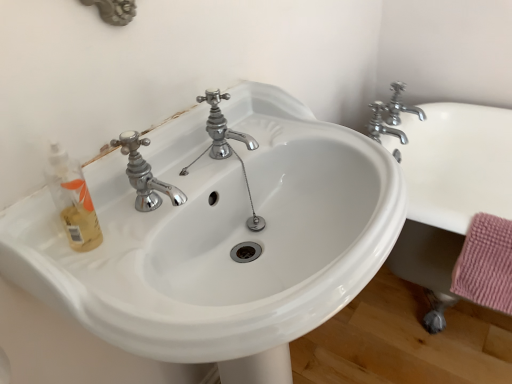
This screenshot has width=512, height=384. Identify the location of white glossy sink at center. (219, 236).

From their relative heights in the image, would you say white ceramic bath at right is taller or shorter than white glossy sink at center?

white ceramic bath at right is shorter than white glossy sink at center.

Does white ceramic bath at right contain white glossy sink at center?

That's incorrect, white glossy sink at center is not inside white ceramic bath at right.

Considering the positions of point (458, 128) and point (293, 203), is point (458, 128) closer or farther from the camera than point (293, 203)?

Point (458, 128) appears to be farther away from the viewer than point (293, 203).

Between white glossy sink at center and chrome metallic faucet at upper right, acting as the first tap starting from the right, which one is positioned behind?

chrome metallic faucet at upper right, acting as the first tap starting from the right, is more distant.

Does point (204, 186) appear closer or farther from the camera than point (388, 107)?

Point (204, 186) is positioned closer to the camera compared to point (388, 107).

Is white glossy sink at center outside of chrome metallic faucet at upper right, acting as the first tap starting from the right?

Yes, white glossy sink at center is located beyond the bounds of chrome metallic faucet at upper right, acting as the first tap starting from the right.

Is white ceramic bath at right next to chrome metallic faucet at upper right, the 1th tap viewed from the left?

No, white ceramic bath at right is not with chrome metallic faucet at upper right, the 1th tap viewed from the left.

Find the location of `bath that is under the chrome metallic faucet at upper right, the 1th tap viewed from the left (from a real-world perspective)`. bath that is under the chrome metallic faucet at upper right, the 1th tap viewed from the left (from a real-world perspective) is located at coordinates tap(449, 191).

In the scene shown: Does white ceramic bath at right have a greater height compared to chrome metallic faucet at upper right, the second tap from the right?

Correct, white ceramic bath at right is much taller as chrome metallic faucet at upper right, the second tap from the right.

In terms of width, does white ceramic bath at right look wider or thinner when compared to chrome metallic faucet at upper right, the second tap from the right?

white ceramic bath at right is wider than chrome metallic faucet at upper right, the second tap from the right.

Which of these two, chrome metallic faucet at upper right, acting as the first tap starting from the right, or white ceramic bath at right, is wider?

white ceramic bath at right.

Is chrome metallic faucet at upper right, acting as the 2th tap starting from the left, turned away from white ceramic bath at right?

No, chrome metallic faucet at upper right, acting as the 2th tap starting from the left, is not facing away from white ceramic bath at right.

Would you say chrome metallic faucet at upper right, acting as the first tap starting from the right, is inside or outside white ceramic bath at right?

chrome metallic faucet at upper right, acting as the first tap starting from the right, is located beyond the bounds of white ceramic bath at right.

What are the coordinates of `bath below the chrome metallic faucet at upper right, acting as the first tap starting from the right (from a real-world perspective)` in the screenshot? It's located at (449, 191).

From the image's perspective, between chrome metallic faucet at upper right, the second tap from the right, and white ceramic bath at right, who is located below?

white ceramic bath at right appears lower in the image.

Can you see chrome metallic faucet at upper right, the second tap from the right, touching white ceramic bath at right?

No, chrome metallic faucet at upper right, the second tap from the right, is not next to white ceramic bath at right.

Is chrome metallic faucet at upper right, the second tap from the right, in front of white ceramic bath at right?

No, chrome metallic faucet at upper right, the second tap from the right, is further to the viewer.

Which is more to the right, chrome metallic faucet at upper right, the second tap from the right, or white ceramic bath at right?

white ceramic bath at right.

Is the surface of white ceramic bath at right in direct contact with chrome metallic faucet at upper right, acting as the first tap starting from the right?

No, white ceramic bath at right is not making contact with chrome metallic faucet at upper right, acting as the first tap starting from the right.

Measure the distance between white ceramic bath at right and chrome metallic faucet at upper right, acting as the first tap starting from the right.

7.60 inches.

From the image's perspective, is white ceramic bath at right located above or below chrome metallic faucet at upper right, acting as the 2th tap starting from the left?

From the image's perspective, white ceramic bath at right appears below chrome metallic faucet at upper right, acting as the 2th tap starting from the left.

Find the location of `bath that appears below the chrome metallic faucet at upper right, acting as the 2th tap starting from the left (from a real-world perspective)`. bath that appears below the chrome metallic faucet at upper right, acting as the 2th tap starting from the left (from a real-world perspective) is located at coordinates (449, 191).

How many degrees apart are the facing directions of chrome metallic faucet at upper right, acting as the 2th tap starting from the left, and white glossy sink at center?

They differ by 0.557 degrees in their facing directions.

From a real-world perspective, which is physically above, chrome metallic faucet at upper right, acting as the 2th tap starting from the left, or white glossy sink at center?

chrome metallic faucet at upper right, acting as the 2th tap starting from the left, from a real-world perspective.

From the picture: Is chrome metallic faucet at upper right, acting as the 2th tap starting from the left, positioned with its back to white glossy sink at center?

No, chrome metallic faucet at upper right, acting as the 2th tap starting from the left, is not facing away from white glossy sink at center.

Considering the sizes of objects chrome metallic faucet at upper right, acting as the 2th tap starting from the left, and white glossy sink at center in the image provided, who is shorter, chrome metallic faucet at upper right, acting as the 2th tap starting from the left, or white glossy sink at center?

Standing shorter between the two is chrome metallic faucet at upper right, acting as the 2th tap starting from the left.

Find the location of a particular element. Image resolution: width=512 pixels, height=384 pixels. sink that is in front of the white ceramic bath at right is located at coordinates (219, 236).

Where is `tap that is the 2nd object located above the white glossy sink at center (from the image's perspective)`? The width and height of the screenshot is (512, 384). tap that is the 2nd object located above the white glossy sink at center (from the image's perspective) is located at coordinates (400, 106).

Based on their spatial positions, is chrome metallic faucet at upper right, the second tap from the right, or white ceramic bath at right further from white glossy sink at center?

Among the two, white ceramic bath at right is located further to white glossy sink at center.

Based on the photo, considering their positions, is white glossy sink at center positioned further to white ceramic bath at right than chrome metallic faucet at upper right, acting as the first tap starting from the right?

white glossy sink at center.

When comparing their distances from chrome metallic faucet at upper right, acting as the first tap starting from the right, does white glossy sink at center or chrome metallic faucet at upper right, the second tap from the right, seem closer?

Based on the image, chrome metallic faucet at upper right, the second tap from the right, appears to be nearer to chrome metallic faucet at upper right, acting as the first tap starting from the right.

Considering their positions, is chrome metallic faucet at upper right, the 1th tap viewed from the left, positioned closer to chrome metallic faucet at upper right, acting as the first tap starting from the right, than white glossy sink at center?

chrome metallic faucet at upper right, the 1th tap viewed from the left.

Which object lies nearer to the anchor point chrome metallic faucet at upper right, acting as the 2th tap starting from the left, white ceramic bath at right or white glossy sink at center?

Among the two, white ceramic bath at right is located nearer to chrome metallic faucet at upper right, acting as the 2th tap starting from the left.

Looking at the image, which one is located further to chrome metallic faucet at upper right, the second tap from the right, chrome metallic faucet at upper right, acting as the first tap starting from the right, or white ceramic bath at right?

white ceramic bath at right is further to chrome metallic faucet at upper right, the second tap from the right.

Estimate the real-world distances between objects in this image. Which object is closer to white glossy sink at center, chrome metallic faucet at upper right, acting as the first tap starting from the right, or chrome metallic faucet at upper right, the 1th tap viewed from the left?

chrome metallic faucet at upper right, the 1th tap viewed from the left, is closer to white glossy sink at center.

When comparing their distances from white glossy sink at center, does white ceramic bath at right or chrome metallic faucet at upper right, acting as the 2th tap starting from the left, seem closer?

white ceramic bath at right is closer to white glossy sink at center.

Where is `tap positioned between white glossy sink at center and chrome metallic faucet at upper right, acting as the first tap starting from the right, from near to far`? The width and height of the screenshot is (512, 384). tap positioned between white glossy sink at center and chrome metallic faucet at upper right, acting as the first tap starting from the right, from near to far is located at coordinates (391, 115).

This screenshot has height=384, width=512. Identify the location of bath between white glossy sink at center and chrome metallic faucet at upper right, the second tap from the right, along the z-axis. (449, 191).

Find the location of `tap between white ceramic bath at right and chrome metallic faucet at upper right, acting as the first tap starting from the right, along the z-axis`. tap between white ceramic bath at right and chrome metallic faucet at upper right, acting as the first tap starting from the right, along the z-axis is located at coordinates (391, 115).

Locate an element on the screen. bath between white glossy sink at center and chrome metallic faucet at upper right, acting as the 2th tap starting from the left, in the front-back direction is located at coordinates (449, 191).